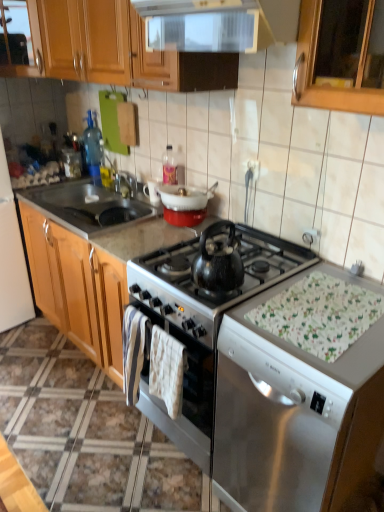
Question: In terms of width, does white fabric placemat at lower right look wider or thinner when compared to white textured towel at center?

Choices:
 (A) wide
 (B) thin

Answer: (A)

Question: Looking at the image, does white fabric placemat at lower right seem bigger or smaller compared to white textured towel at center?

Choices:
 (A) small
 (B) big

Answer: (A)

Question: Based on their relative distances, which object is farther from the white marble countertop at center?

Choices:
 (A) shiny black kettle at center
 (B) white glossy refrigerator at left, which appears as the 1th appliance when viewed from the left
 (C) white glossy microwave at upper center
 (D) wooden cabinet at upper left
 (E) metallic stainless steel sink at left, positioned as the 2th sink in right-to-left order

Answer: (C)

Question: Which object is positioned farthest from the satin black kettle at center, which appears as the first appliance when viewed from the right?

Choices:
 (A) metallic stainless steel sink at left, positioned as the 1th sink in left-to-right order
 (B) white marble countertop at center
 (C) white fabric placemat at lower right
 (D) white glossy refrigerator at left, which appears as the 1th appliance when viewed from the left
 (E) white glossy microwave at upper center

Answer: (D)